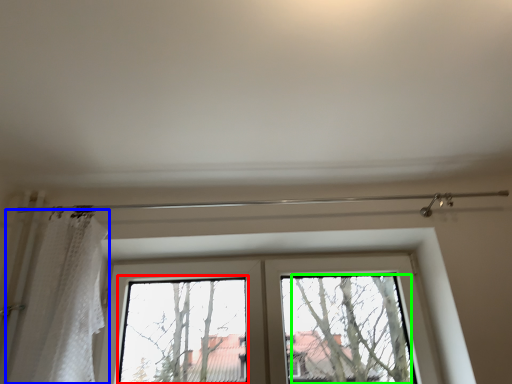
Question: Estimate the real-world distances between objects in this image. Which object is farther from bay window (highlighted by a red box), shower curtain (highlighted by a blue box) or tree (highlighted by a green box)?

Choices:
 (A) shower curtain
 (B) tree

Answer: (B)